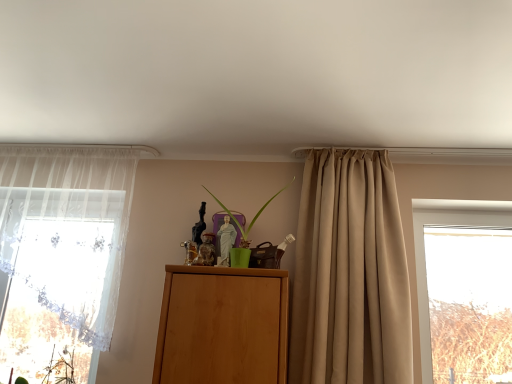
What do you see at coordinates (254, 216) in the screenshot? I see `green matte plant at center` at bounding box center [254, 216].

Measure the distance between point (x=285, y=186) and camera.

Point (x=285, y=186) and camera are 8.33 feet apart from each other.

The width and height of the screenshot is (512, 384). Describe the element at coordinates (350, 273) in the screenshot. I see `beige satin curtain at center, which appears as the 2th curtain when viewed from the left` at that location.

This screenshot has width=512, height=384. Identify the location of green matte plant at center. (254, 216).

Would you say green matte plant at center is inside or outside sheer white curtain at left, positioned as the 1th curtain in left-to-right order?

green matte plant at center exists outside the volume of sheer white curtain at left, positioned as the 1th curtain in left-to-right order.

Does point (244, 240) appear closer or farther from the camera than point (94, 355)?

Point (244, 240) appears to be farther away from the viewer than point (94, 355).

Considering the positions of objects green matte plant at center and sheer white curtain at left, positioned as the 1th curtain in left-to-right order, in the image provided, who is more to the right, green matte plant at center or sheer white curtain at left, positioned as the 1th curtain in left-to-right order,?

Positioned to the right is green matte plant at center.

Are green matte plant at center and sheer white curtain at left, the second curtain viewed from the right, far apart?

green matte plant at center is near sheer white curtain at left, the second curtain viewed from the right, not far away.

Which object is positioned more to the right, green matte plant at center or beige satin curtain at center, which appears as the 2th curtain when viewed from the left?

Positioned to the right is beige satin curtain at center, which appears as the 2th curtain when viewed from the left.

Is green matte plant at center oriented towards beige satin curtain at center, which appears as the 2th curtain when viewed from the left?

No.

Image resolution: width=512 pixels, height=384 pixels. Find the location of `plant positioned vertically above the beige satin curtain at center, which appears as the 2th curtain when viewed from the left (from a real-world perspective)`. plant positioned vertically above the beige satin curtain at center, which appears as the 2th curtain when viewed from the left (from a real-world perspective) is located at coordinates (254, 216).

Would you say beige satin curtain at center, which appears as the 2th curtain when viewed from the left, is part of green matte plant at center's contents?

No, green matte plant at center does not contain beige satin curtain at center, which appears as the 2th curtain when viewed from the left.

Is point (293, 382) behind point (236, 218)?

No, it is in front of (236, 218).

Can you confirm if beige satin curtain at center, the 1th curtain in the right-to-left sequence, is thinner than green matte plant at center?

No.

From the image's perspective, which object appears higher, beige satin curtain at center, which appears as the 2th curtain when viewed from the left, or sheer white curtain at left, positioned as the 1th curtain in left-to-right order?

sheer white curtain at left, positioned as the 1th curtain in left-to-right order, appears higher in the image.

Are beige satin curtain at center, which appears as the 2th curtain when viewed from the left, and sheer white curtain at left, positioned as the 1th curtain in left-to-right order, beside each other?

beige satin curtain at center, which appears as the 2th curtain when viewed from the left, and sheer white curtain at left, positioned as the 1th curtain in left-to-right order, are not in contact.

Is beige satin curtain at center, the 1th curtain in the right-to-left sequence, in front of sheer white curtain at left, positioned as the 1th curtain in left-to-right order?

Yes, it is in front of sheer white curtain at left, positioned as the 1th curtain in left-to-right order.

Does beige satin curtain at center, which appears as the 2th curtain when viewed from the left, have a lesser width compared to sheer white curtain at left, positioned as the 1th curtain in left-to-right order?

No.

From the image's perspective, is sheer white curtain at left, the second curtain viewed from the right, positioned above or below beige satin curtain at center, the 1th curtain in the right-to-left sequence?

Clearly, from the image's perspective, sheer white curtain at left, the second curtain viewed from the right, is above beige satin curtain at center, the 1th curtain in the right-to-left sequence.

Is point (78, 182) behind point (343, 184)?

Yes, it is behind point (343, 184).

This screenshot has width=512, height=384. What are the coordinates of `curtain that is under the sheer white curtain at left, the second curtain viewed from the right (from a real-world perspective)` in the screenshot? It's located at (350, 273).

In terms of width, does sheer white curtain at left, positioned as the 1th curtain in left-to-right order, look wider or thinner when compared to green matte plant at center?

Considering their sizes, sheer white curtain at left, positioned as the 1th curtain in left-to-right order, looks slimmer than green matte plant at center.

Looking at this image, is sheer white curtain at left, the second curtain viewed from the right, at the right side of green matte plant at center?

In fact, sheer white curtain at left, the second curtain viewed from the right, is to the left of green matte plant at center.

Based on the photo, does sheer white curtain at left, the second curtain viewed from the right, have a lesser height compared to green matte plant at center?

Incorrect, the height of sheer white curtain at left, the second curtain viewed from the right, does not fall short of that of green matte plant at center.

In the scene shown: From the image's perspective, is sheer white curtain at left, positioned as the 1th curtain in left-to-right order, on top of green matte plant at center?

Incorrect, from the image's perspective, sheer white curtain at left, positioned as the 1th curtain in left-to-right order, is lower than green matte plant at center.

Where is `curtain lying behind the green matte plant at center`? The height and width of the screenshot is (384, 512). curtain lying behind the green matte plant at center is located at coordinates (74, 173).

You are a GUI agent. You are given a task and a screenshot of the screen. Output one action in this format:
    pyautogui.click(x=<x>, y=<y>)
    Task: Click on the curtain that is in front of the green matte plant at center
    
    Given the screenshot: What is the action you would take?
    pyautogui.click(x=350, y=273)

Estimate the real-world distances between objects in this image. Which object is further from beige satin curtain at center, the 1th curtain in the right-to-left sequence, sheer white curtain at left, positioned as the 1th curtain in left-to-right order, or green matte plant at center?

Among the two, sheer white curtain at left, positioned as the 1th curtain in left-to-right order, is located further to beige satin curtain at center, the 1th curtain in the right-to-left sequence.

Considering their positions, is green matte plant at center positioned further to sheer white curtain at left, the second curtain viewed from the right, than beige satin curtain at center, the 1th curtain in the right-to-left sequence?

beige satin curtain at center, the 1th curtain in the right-to-left sequence, lies further to sheer white curtain at left, the second curtain viewed from the right, than the other object.

Based on their spatial positions, is green matte plant at center or sheer white curtain at left, positioned as the 1th curtain in left-to-right order, further from beige satin curtain at center, the 1th curtain in the right-to-left sequence?

sheer white curtain at left, positioned as the 1th curtain in left-to-right order, lies further to beige satin curtain at center, the 1th curtain in the right-to-left sequence, than the other object.

Based on their spatial positions, is sheer white curtain at left, the second curtain viewed from the right, or beige satin curtain at center, which appears as the 2th curtain when viewed from the left, closer to green matte plant at center?

beige satin curtain at center, which appears as the 2th curtain when viewed from the left, is closer to green matte plant at center.

Consider the image. Looking at the image, which one is located closer to green matte plant at center, beige satin curtain at center, the 1th curtain in the right-to-left sequence, or sheer white curtain at left, the second curtain viewed from the right?

beige satin curtain at center, the 1th curtain in the right-to-left sequence.

Estimate the real-world distances between objects in this image. Which object is closer to sheer white curtain at left, positioned as the 1th curtain in left-to-right order, beige satin curtain at center, the 1th curtain in the right-to-left sequence, or green matte plant at center?

Among the two, green matte plant at center is located nearer to sheer white curtain at left, positioned as the 1th curtain in left-to-right order.

Locate an element on the screen. Image resolution: width=512 pixels, height=384 pixels. plant between sheer white curtain at left, the second curtain viewed from the right, and beige satin curtain at center, the 1th curtain in the right-to-left sequence, from left to right is located at coordinates (254, 216).